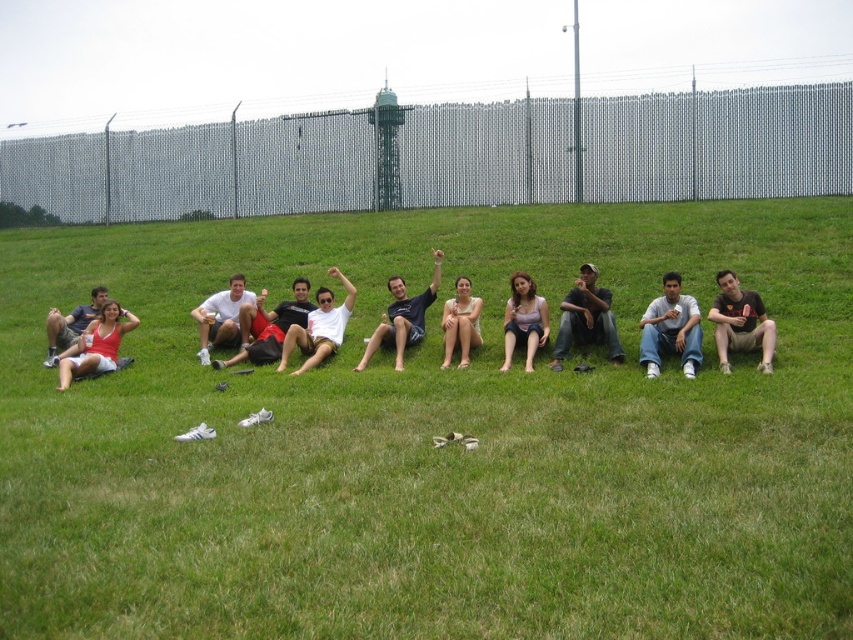
Who is higher up, matte white shirt at center or matte pink shirt at center?

matte white shirt at center is higher up.

Which is in front, point (254, 310) or point (544, 310)?

Point (544, 310) is in front.

Where is `matte white shirt at center`? matte white shirt at center is located at coordinates (268, 326).

Does matte white shirt at center come behind matte white shirt at left?

No, it is in front of matte white shirt at left.

You are a GUI agent. You are given a task and a screenshot of the screen. Output one action in this format:
    pyautogui.click(x=<x>, y=<y>)
    Task: Click on the matte white shirt at center
    The width and height of the screenshot is (853, 640).
    Given the screenshot: What is the action you would take?
    pyautogui.click(x=268, y=326)

Is point (282, 326) positioned after point (96, 307)?

No, (282, 326) is closer to viewer.

Locate an element on the screen. matte white shirt at center is located at coordinates (268, 326).

Is metallic silver fence at upper center smaller than light blue jeans at center?

No, metallic silver fence at upper center is not smaller than light blue jeans at center.

Between point (189, 195) and point (698, 355), which one is positioned in front?

Point (698, 355) is in front.

The height and width of the screenshot is (640, 853). I want to click on metallic silver fence at upper center, so pos(302,163).